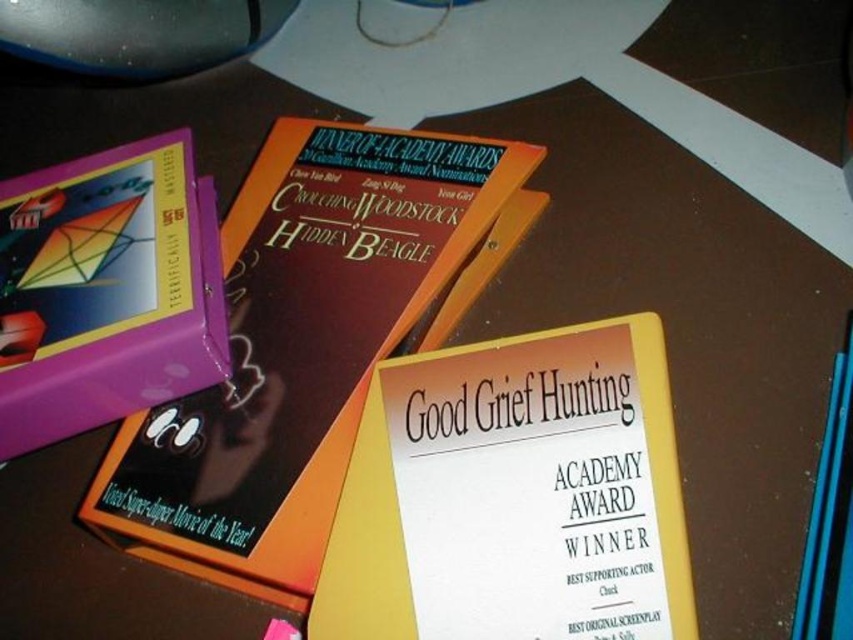
Does yellow paper at center lie in front of black plastic mouse at upper left?

Yes, it is in front of black plastic mouse at upper left.

Locate an element on the screen. The image size is (853, 640). yellow paper at center is located at coordinates (514, 496).

Identify the location of yellow paper at center. This screenshot has width=853, height=640. (514, 496).

Is yellow paper at center in front of purple matte book at left?

Yes, it is in front of purple matte book at left.

Image resolution: width=853 pixels, height=640 pixels. I want to click on yellow paper at center, so click(514, 496).

Can you confirm if matte orange book at center is taller than purple matte book at left?

Indeed, matte orange book at center has a greater height compared to purple matte book at left.

Between matte orange book at center and purple matte book at left, which one has more height?

matte orange book at center

Which is in front, point (252, 189) or point (207, 342)?

Positioned in front is point (207, 342).

Find the location of a particular element. matte orange book at center is located at coordinates (299, 346).